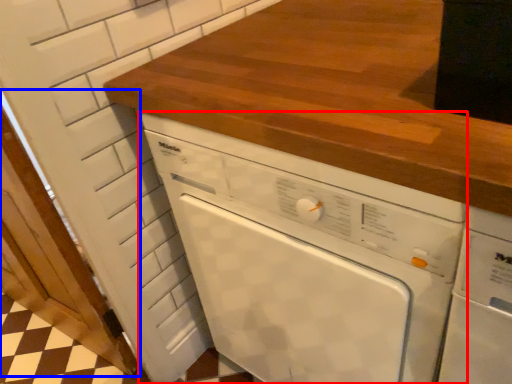
Question: Among these objects, which one is farthest to the camera, home appliance (highlighted by a red box) or door (highlighted by a blue box)?

Choices:
 (A) home appliance
 (B) door

Answer: (B)